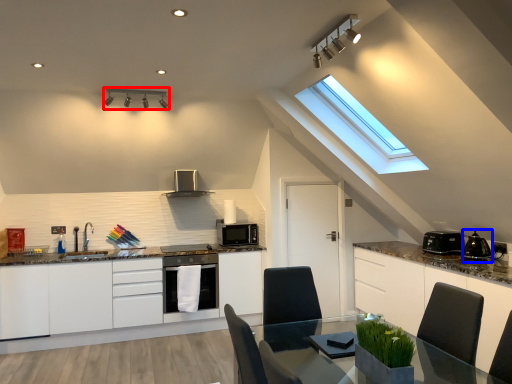
Question: Which object appears closest to the camera in this image, light fixture (highlighted by a red box) or appliance (highlighted by a blue box)?

Choices:
 (A) light fixture
 (B) appliance

Answer: (B)